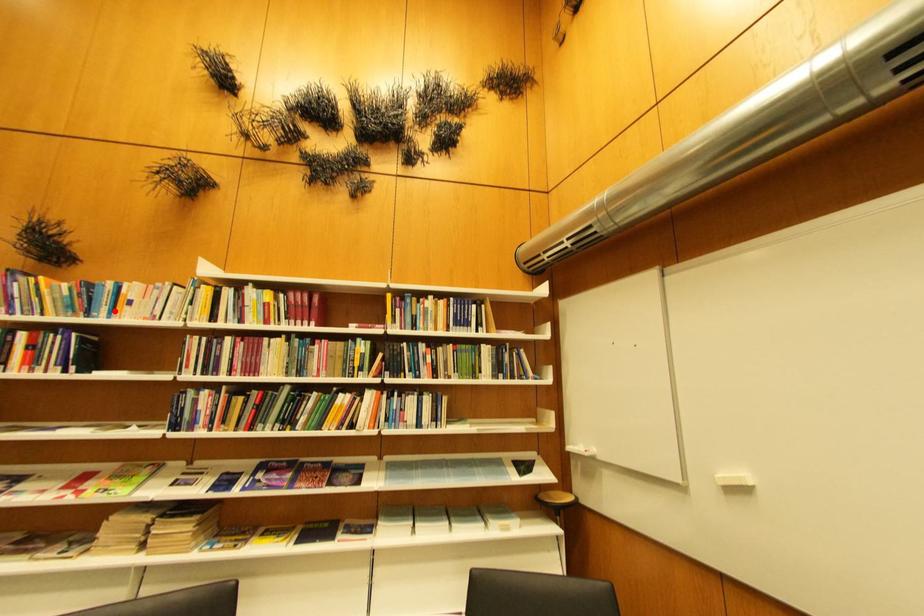
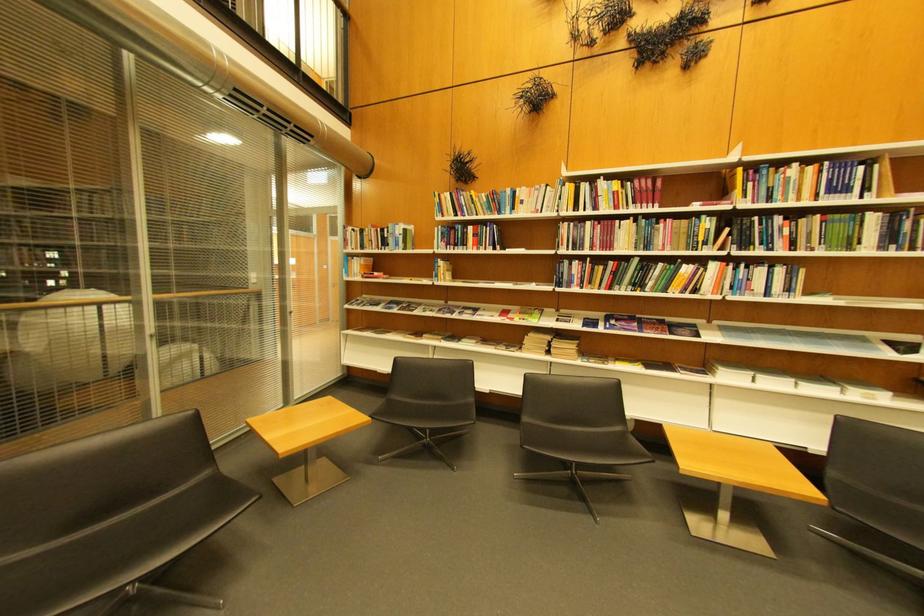
Where in the second image is the point corresponding to the highlighted location from the first image?

(518, 209)